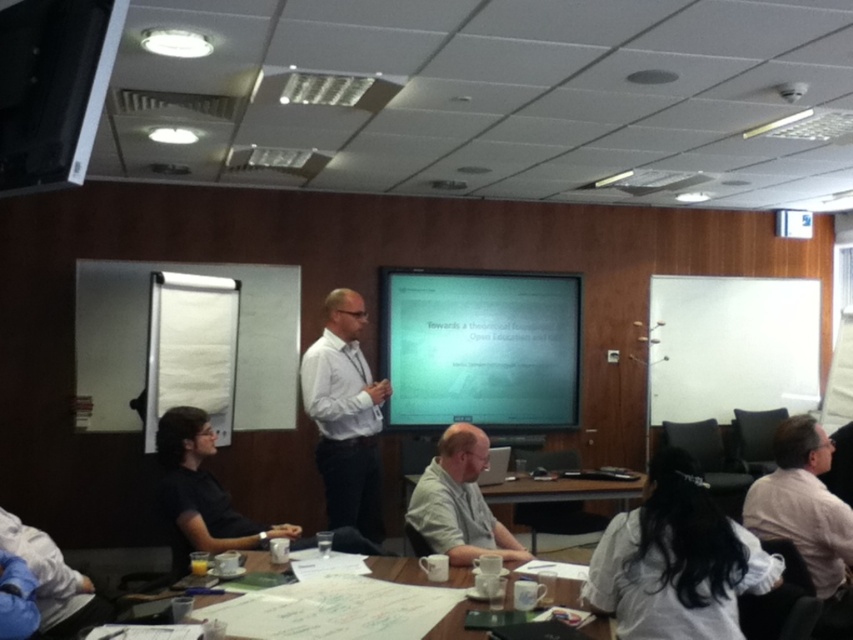
Which is behind, point (393, 296) or point (738, 636)?

The point (393, 296) is behind.

Does matte white projector screen at center appear on the left side of white matte shirt at lower right?

Yes, matte white projector screen at center is to the left of white matte shirt at lower right.

Is point (462, 314) positioned before point (772, 573)?

No, it is not.

The width and height of the screenshot is (853, 640). What are the coordinates of `matte white projector screen at center` in the screenshot? It's located at point(480,348).

Does matte white projector screen at center have a greater width compared to light beige shirt at center?

Correct, the width of matte white projector screen at center exceeds that of light beige shirt at center.

Can you confirm if matte white projector screen at center is thinner than light beige shirt at center?

No.

Where is `matte white projector screen at center`? matte white projector screen at center is located at coordinates [x=480, y=348].

Where is `matte white projector screen at center`? The height and width of the screenshot is (640, 853). matte white projector screen at center is located at coordinates (480, 348).

Does white shirt at right have a lesser height compared to wooden table at center?

In fact, white shirt at right may be taller than wooden table at center.

Does white shirt at right appear on the left side of wooden table at center?

Incorrect, white shirt at right is not on the left side of wooden table at center.

Measure the distance between white shirt at right and camera.

white shirt at right is 9.34 feet from camera.

Identify the location of white shirt at right. This screenshot has width=853, height=640. (805, 508).